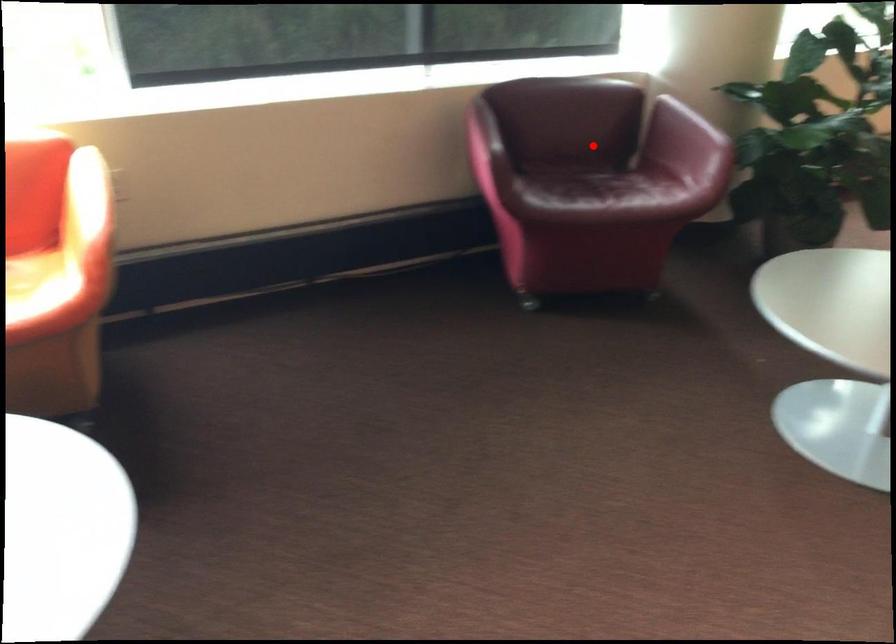
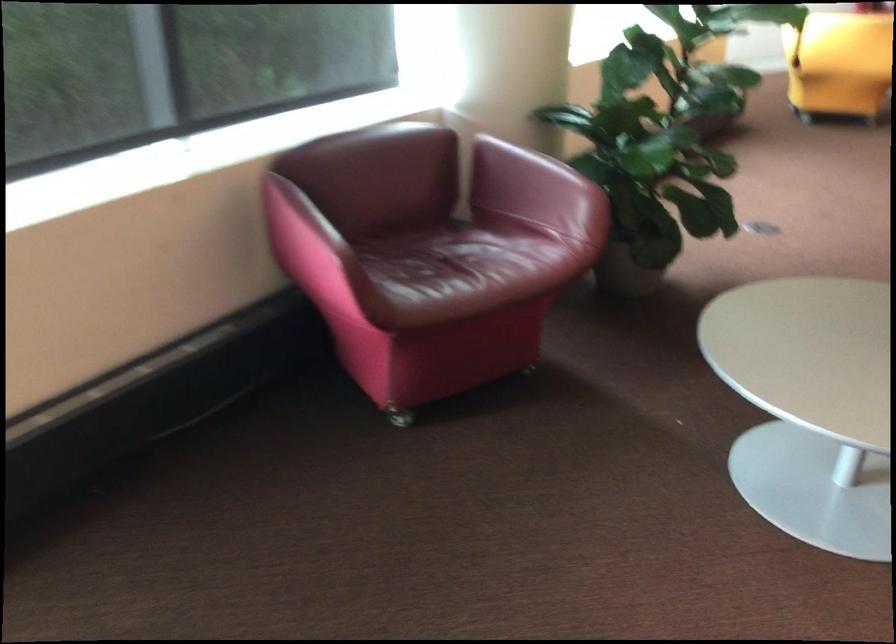
Question: I am providing you with two images of the same scene from different viewpoints. Given a red point in image1, look at the same physical point in image2. Is it:

Choices:
 (A) Closer to the viewpoint
 (B) Farther from the viewpoint

Answer: (A)